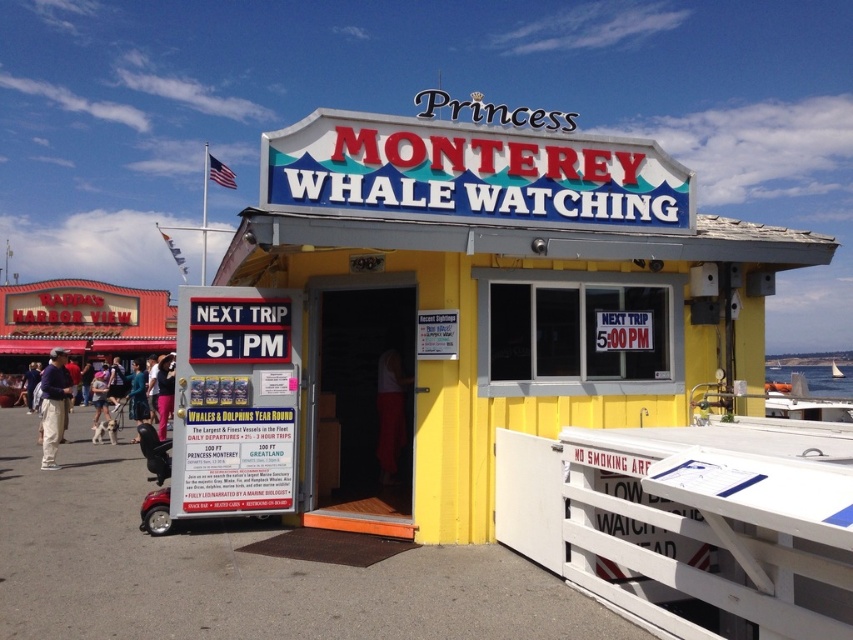
Question: Among these objects, which one is nearest to the camera?

Choices:
 (A) light brown leather jacket at lower left
 (B) dark blue sweater at left
 (C) pink fabric pants at lower left

Answer: (A)

Question: Is white painted wood dock at lower right smaller than dark blue sweater at left?

Choices:
 (A) yes
 (B) no

Answer: (A)

Question: Which of the following is the farthest from the observer?

Choices:
 (A) (50, 419)
 (B) (813, 618)

Answer: (A)

Question: Which point is farther from the camera taking this photo?

Choices:
 (A) (653, 580)
 (B) (164, 416)
 (C) (45, 388)

Answer: (B)

Question: In this image, where is dark blue sweater at left located relative to pink fabric pants at lower left?

Choices:
 (A) above
 (B) below

Answer: (A)

Question: Does light brown leather jacket at lower left have a lesser width compared to blue denim jeans at center?

Choices:
 (A) yes
 (B) no

Answer: (B)